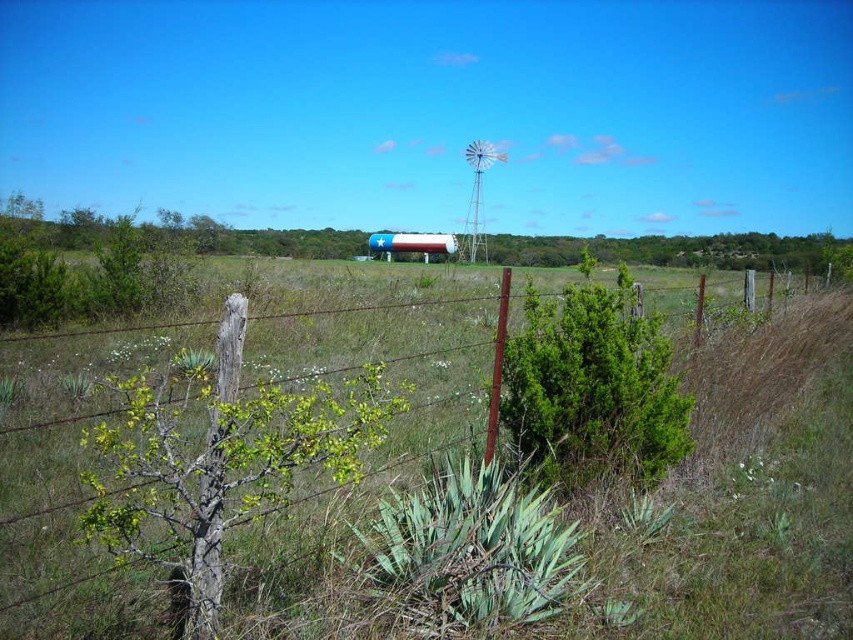
You are a gardener who needs to water the green leafy bush at center and the green grass at center. Your watering can has a range of 2 meters. Can you water both without moving the can? Please explain your reasoning.

The green grass at center is 2.18 meters away from the green leafy bush at center. Since the watering can has a range of only 2 meters, it cannot reach both the green grass at center and the green leafy bush at center simultaneously without moving the can. You will need to move the watering can closer to each to water them.